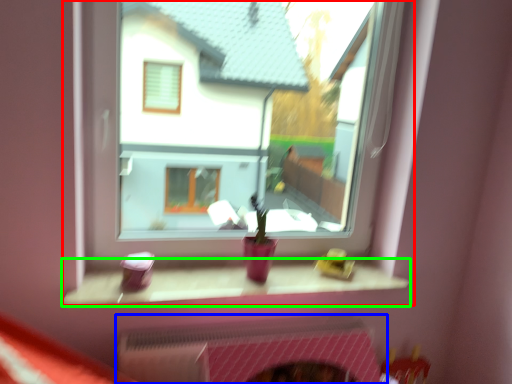
Question: Which is nearer to the window (highlighted by a red box)? fireplace (highlighted by a blue box) or window sill (highlighted by a green box).

Choices:
 (A) fireplace
 (B) window sill

Answer: (B)